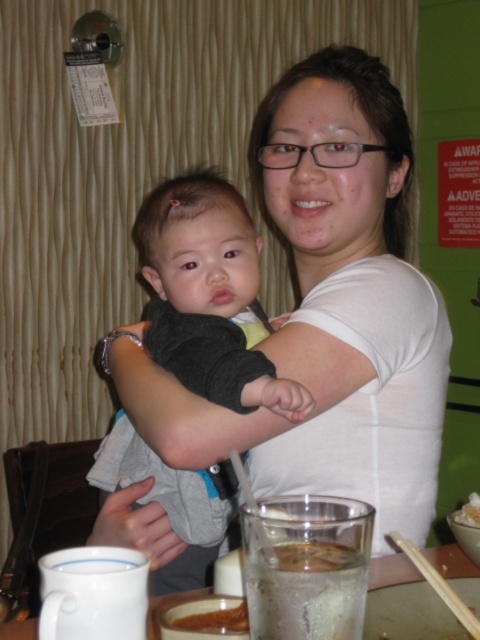
Which is behind, point (237, 276) or point (233, 609)?

The point (237, 276) is behind.

Which is below, gray soft baby at center or brown creamy soup at lower center?

brown creamy soup at lower center is lower down.

Image resolution: width=480 pixels, height=640 pixels. What do you see at coordinates (212, 285) in the screenshot?
I see `gray soft baby at center` at bounding box center [212, 285].

This screenshot has height=640, width=480. Identify the location of gray soft baby at center. (212, 285).

Between point (230, 627) and point (468, 518), which one is positioned in front?

Point (230, 627) is more forward.

Does brown creamy soup at lower center come behind white creamy rice at center?

No, it is not.

Which is in front, point (240, 604) or point (478, 493)?

Point (240, 604)

The image size is (480, 640). Identify the location of brown creamy soup at lower center. (216, 620).

Which is more to the right, gray soft baby at center or white creamy rice at center?

white creamy rice at center

Can you confirm if gray soft baby at center is bigger than white creamy rice at center?

Correct, gray soft baby at center is larger in size than white creamy rice at center.

Does point (191, 481) come in front of point (465, 506)?

No, (191, 481) is behind (465, 506).

Identify the location of gray soft baby at center. (212, 285).